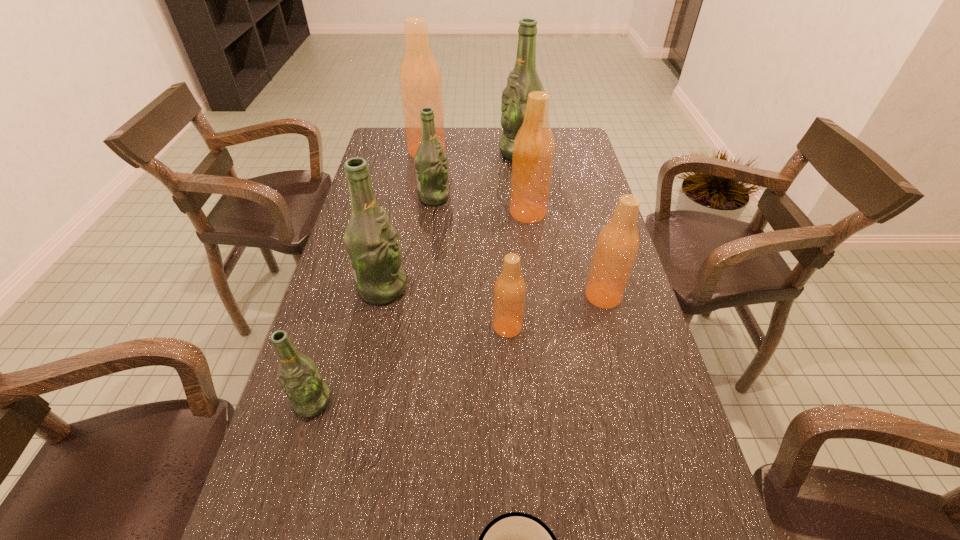
You are a GUI agent. You are given a task and a screenshot of the screen. Output one action in this format:
    pyautogui.click(x=<x>, y=<y>)
    Task: Click on the tan beer bottle identified as the closest to the third farthest green beer bottle
    This screenshot has height=540, width=960.
    Given the screenshot: What is the action you would take?
    pyautogui.click(x=510, y=288)

Select which tan beer bottle is the closest to the second nearest green beer bottle. Please provide its 2D coordinates. Your answer should be formatted as a tuple, i.e. [(x, y)], where the tuple contains the x and y coordinates of a point satisfying the conditions above.

[(510, 288)]

The image size is (960, 540). I want to click on vacant space that satisfies the following two spatial constraints: 1. on the surface of the rightmost tan beer bottle; 2. on the left side of the biggest green beer bottle, so click(x=538, y=296).

I want to click on free space in the image that satisfies the following two spatial constraints: 1. on the surface of the third farthest tan beer bottle; 2. on the left side of the second smallest green beer bottle, so click(421, 296).

Image resolution: width=960 pixels, height=540 pixels. I want to click on free spot that satisfies the following two spatial constraints: 1. on the surface of the rightmost object; 2. on the right side of the second biggest green beer bottle, so click(380, 296).

Locate an element on the screen. Image resolution: width=960 pixels, height=540 pixels. free spot that satisfies the following two spatial constraints: 1. on the back side of the third smallest tan beer bottle; 2. on the surface of the farthest green beer bottle is located at coordinates (520, 153).

Where is `vacant space that satisfies the following two spatial constraints: 1. on the surface of the second smallest green beer bottle; 2. on the surface of the eighth farthest object`? This screenshot has height=540, width=960. vacant space that satisfies the following two spatial constraints: 1. on the surface of the second smallest green beer bottle; 2. on the surface of the eighth farthest object is located at coordinates (408, 402).

You are a GUI agent. You are given a task and a screenshot of the screen. Output one action in this format:
    pyautogui.click(x=<x>, y=<y>)
    Task: Click on the free spot that satisfies the following two spatial constraints: 1. on the surface of the smallest tan beer bottle; 2. on the left side of the third smallest green beer bottle
    The image size is (960, 540).
    Given the screenshot: What is the action you would take?
    pyautogui.click(x=373, y=327)

Where is `vacant region that satisfies the following two spatial constraints: 1. on the surface of the third nearest tan beer bottle; 2. on the right side of the second smallest green beer bottle`? This screenshot has height=540, width=960. vacant region that satisfies the following two spatial constraints: 1. on the surface of the third nearest tan beer bottle; 2. on the right side of the second smallest green beer bottle is located at coordinates (432, 213).